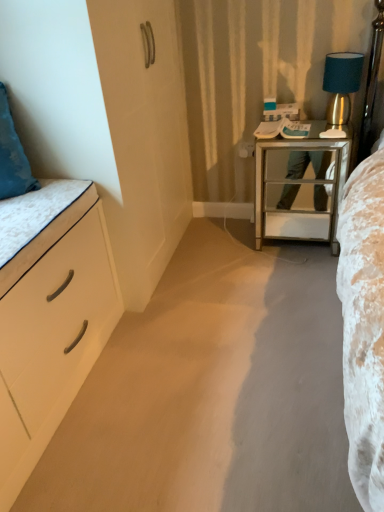
What is the approximate height of white matte chest of drawers at left?

It is 24.38 inches.

At what (x,y) coordinates should I click in order to perform the action: click on white matte drawer at left. Please return your answer as a coordinate pair (x, y). The height and width of the screenshot is (512, 384). Looking at the image, I should click on (56, 244).

The image size is (384, 512). Identify the location of white matte chest of drawers at left. (51, 331).

Is mirrored glass nightstand at center right positioned with its back to white matte chest of drawers at left?

No.

Which is nearer, (x=255, y=220) or (x=102, y=290)?

The point (x=102, y=290) is more forward.

From the picture: Which of these two, mirrored glass nightstand at center right or white matte chest of drawers at left, stands shorter?

white matte chest of drawers at left is shorter.

From the image's perspective, is white matte chest of drawers at left located above mirrored glass nightstand at center right?

Actually, white matte chest of drawers at left appears below mirrored glass nightstand at center right in the image.

Identify the location of chest of drawers below the mirrored glass nightstand at center right (from a real-world perspective). (51, 331).

Is white matte chest of drawers at left facing away from mirrored glass nightstand at center right?

No, white matte chest of drawers at left's orientation is not away from mirrored glass nightstand at center right.

In the image, is white matte chest of drawers at left positioned in front of or behind mirrored glass nightstand at center right?

Visually, white matte chest of drawers at left is located in front of mirrored glass nightstand at center right.

Can you confirm if white matte chest of drawers at left is positioned to the right of white matte drawer at left?

Incorrect, white matte chest of drawers at left is not on the right side of white matte drawer at left.

From a real-world perspective, which object rests below the other?

In real-world perspective, white matte chest of drawers at left is lower.

Is white matte chest of drawers at left next to white matte drawer at left?

They are not placed beside each other.

From the picture: Is teal fabric lampshade at upper right shorter than white matte drawer at left?

No, teal fabric lampshade at upper right is not shorter than white matte drawer at left.

From a real-world perspective, which is physically above, teal fabric lampshade at upper right or white matte drawer at left?

teal fabric lampshade at upper right, from a real-world perspective.

Consider the image. Could white matte drawer at left be considered to be inside teal fabric lampshade at upper right?

No, white matte drawer at left is not inside teal fabric lampshade at upper right.

Who is more distant, teal fabric lampshade at upper right or white matte drawer at left?

teal fabric lampshade at upper right is further away from the camera.

Is white matte drawer at left completely or partially outside of mirrored glass nightstand at center right?

Indeed, white matte drawer at left is completely outside mirrored glass nightstand at center right.

Considering the relative sizes of white matte drawer at left and mirrored glass nightstand at center right in the image provided, is white matte drawer at left bigger than mirrored glass nightstand at center right?

No, white matte drawer at left is not bigger than mirrored glass nightstand at center right.

Is white matte drawer at left facing away from mirrored glass nightstand at center right?

white matte drawer at left is not turned away from mirrored glass nightstand at center right.

Considering the relative sizes of white matte drawer at left and mirrored glass nightstand at center right in the image provided, is white matte drawer at left shorter than mirrored glass nightstand at center right?

Indeed, white matte drawer at left has a lesser height compared to mirrored glass nightstand at center right.

Considering the positions of objects teal fabric lampshade at upper right and mirrored glass nightstand at center right in the image provided, who is behind, teal fabric lampshade at upper right or mirrored glass nightstand at center right?

teal fabric lampshade at upper right is further away from the camera.

Considering the points (329, 75) and (286, 229), which point is in front, point (329, 75) or point (286, 229)?

Positioned in front is point (329, 75).

Considering the relative sizes of teal fabric lampshade at upper right and mirrored glass nightstand at center right in the image provided, is teal fabric lampshade at upper right thinner than mirrored glass nightstand at center right?

Indeed, teal fabric lampshade at upper right has a lesser width compared to mirrored glass nightstand at center right.

Can you confirm if teal fabric lampshade at upper right is positioned to the left of mirrored glass nightstand at center right?

No, teal fabric lampshade at upper right is not to the left of mirrored glass nightstand at center right.

From the image's perspective, who appears lower, white matte drawer at left or teal fabric lampshade at upper right?

white matte drawer at left appears lower in the image.

Does white matte drawer at left turn towards teal fabric lampshade at upper right?

No, white matte drawer at left does not turn towards teal fabric lampshade at upper right.

From a real-world perspective, is white matte drawer at left physically located above or below teal fabric lampshade at upper right?

Clearly, from a real-world perspective, white matte drawer at left is below teal fabric lampshade at upper right.

Is white matte drawer at left in contact with teal fabric lampshade at upper right?

No, white matte drawer at left is not next to teal fabric lampshade at upper right.

The width and height of the screenshot is (384, 512). Identify the location of nightstand located behind the white matte chest of drawers at left. (300, 184).

This screenshot has width=384, height=512. There is a white matte chest of drawers at left. Find the location of `nightstand above it (from a real-world perspective)`. nightstand above it (from a real-world perspective) is located at coordinates (300, 184).

Looking at the image, which one is located further to white matte chest of drawers at left, white matte drawer at left or mirrored glass nightstand at center right?

Result: mirrored glass nightstand at center right.

Which object lies further to the anchor point mirrored glass nightstand at center right, white matte chest of drawers at left or white matte drawer at left?

The object further to mirrored glass nightstand at center right is white matte chest of drawers at left.

Looking at the image, which one is located further to white matte chest of drawers at left, teal fabric lampshade at upper right or white matte drawer at left?

teal fabric lampshade at upper right lies further to white matte chest of drawers at left than the other object.

Which object lies further to the anchor point mirrored glass nightstand at center right, white matte drawer at left or white matte chest of drawers at left?

The object further to mirrored glass nightstand at center right is white matte chest of drawers at left.

Considering their positions, is white matte chest of drawers at left positioned further to white matte drawer at left than mirrored glass nightstand at center right?

mirrored glass nightstand at center right is positioned further to the anchor white matte drawer at left.

Based on their spatial positions, is white matte chest of drawers at left or mirrored glass nightstand at center right closer to teal fabric lampshade at upper right?

The object closer to teal fabric lampshade at upper right is mirrored glass nightstand at center right.

Considering their positions, is white matte drawer at left positioned further to mirrored glass nightstand at center right than teal fabric lampshade at upper right?

white matte drawer at left is further to mirrored glass nightstand at center right.

From the image, which object appears to be farther from white matte chest of drawers at left, teal fabric lampshade at upper right or mirrored glass nightstand at center right?

teal fabric lampshade at upper right is further to white matte chest of drawers at left.

You are a GUI agent. You are given a task and a screenshot of the screen. Output one action in this format:
    pyautogui.click(x=<x>, y=<y>)
    Task: Click on the nightstand located between white matte drawer at left and teal fabric lampshade at upper right in the left-right direction
    
    Given the screenshot: What is the action you would take?
    pyautogui.click(x=300, y=184)

The width and height of the screenshot is (384, 512). I want to click on nightstand located between white matte chest of drawers at left and teal fabric lampshade at upper right in the left-right direction, so click(300, 184).

The image size is (384, 512). Identify the location of drawer between white matte chest of drawers at left and mirrored glass nightstand at center right in the horizontal direction. (56, 244).

At what (x,y) coordinates should I click in order to perform the action: click on drawer situated between white matte chest of drawers at left and teal fabric lampshade at upper right from left to right. Please return your answer as a coordinate pair (x, y). This screenshot has width=384, height=512. Looking at the image, I should click on (56, 244).